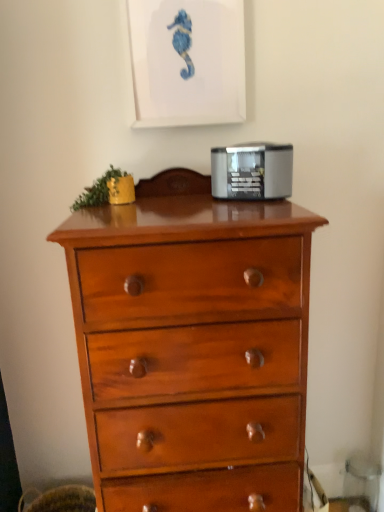
Question: Does matte white picture frame at upper center appear on the right side of shiny wood chest of drawers at center?

Choices:
 (A) yes
 (B) no

Answer: (B)

Question: Could you tell me if matte white picture frame at upper center is turned towards shiny wood chest of drawers at center?

Choices:
 (A) yes
 (B) no

Answer: (B)

Question: Does matte white picture frame at upper center have a smaller size compared to shiny wood chest of drawers at center?

Choices:
 (A) yes
 (B) no

Answer: (A)

Question: Does matte white picture frame at upper center have a larger size compared to shiny wood chest of drawers at center?

Choices:
 (A) yes
 (B) no

Answer: (B)

Question: Would you say shiny wood chest of drawers at center is part of matte white picture frame at upper center's contents?

Choices:
 (A) yes
 (B) no

Answer: (B)

Question: Considering the positions of satin silver toaster at upper center and shiny wood chest of drawers at center in the image, is satin silver toaster at upper center wider or thinner than shiny wood chest of drawers at center?

Choices:
 (A) thin
 (B) wide

Answer: (A)

Question: In the image, is satin silver toaster at upper center on the left side or the right side of shiny wood chest of drawers at center?

Choices:
 (A) right
 (B) left

Answer: (A)

Question: In the image, is satin silver toaster at upper center positioned in front of or behind shiny wood chest of drawers at center?

Choices:
 (A) behind
 (B) front

Answer: (A)

Question: From the image's perspective, relative to shiny wood chest of drawers at center, is satin silver toaster at upper center above or below?

Choices:
 (A) below
 (B) above

Answer: (B)

Question: In terms of size, does matte white picture frame at upper center appear bigger or smaller than satin silver toaster at upper center?

Choices:
 (A) small
 (B) big

Answer: (B)

Question: From the image's perspective, is matte white picture frame at upper center positioned above or below satin silver toaster at upper center?

Choices:
 (A) below
 (B) above

Answer: (B)

Question: Is point (162, 92) positioned closer to the camera than point (251, 148)?

Choices:
 (A) closer
 (B) farther

Answer: (B)

Question: Is matte white picture frame at upper center inside or outside of satin silver toaster at upper center?

Choices:
 (A) inside
 (B) outside

Answer: (B)

Question: From the image's perspective, is matte white picture frame at upper center above or below shiny wood chest of drawers at center?

Choices:
 (A) below
 (B) above

Answer: (B)

Question: Is point (213, 9) positioned closer to the camera than point (175, 308)?

Choices:
 (A) closer
 (B) farther

Answer: (B)